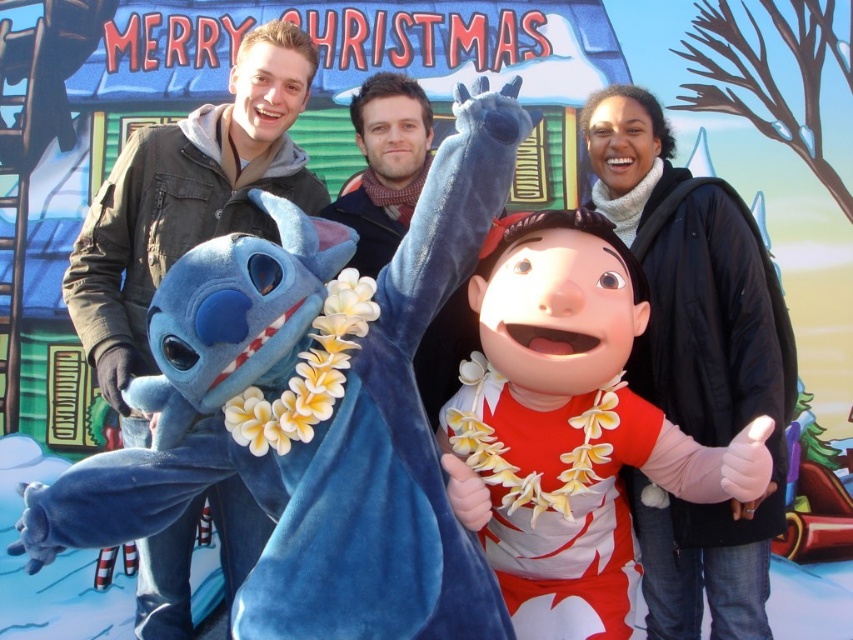
Can you confirm if matte black jacket at upper right is positioned below matte black hoodie at left?

Yes.

Which is behind, point (782, 472) or point (222, 208)?

Positioned behind is point (222, 208).

Locate an element on the screen. Image resolution: width=853 pixels, height=640 pixels. matte black jacket at upper right is located at coordinates (695, 364).

This screenshot has width=853, height=640. What do you see at coordinates (567, 426) in the screenshot? I see `matte red dress at center` at bounding box center [567, 426].

Measure the distance between point (x=508, y=584) and camera.

10.44 meters

Measure the distance between matte red dress at center and camera.

matte red dress at center is 26.00 feet from camera.

Where is `matte red dress at center`? matte red dress at center is located at coordinates (567, 426).

In the scene shown: Does matte red dress at center appear on the left side of matte black hoodie at left?

Incorrect, matte red dress at center is not on the left side of matte black hoodie at left.

Between matte red dress at center and matte black hoodie at left, which one is positioned higher?

Positioned higher is matte black hoodie at left.

Find the location of `matte red dress at center`. matte red dress at center is located at coordinates click(567, 426).